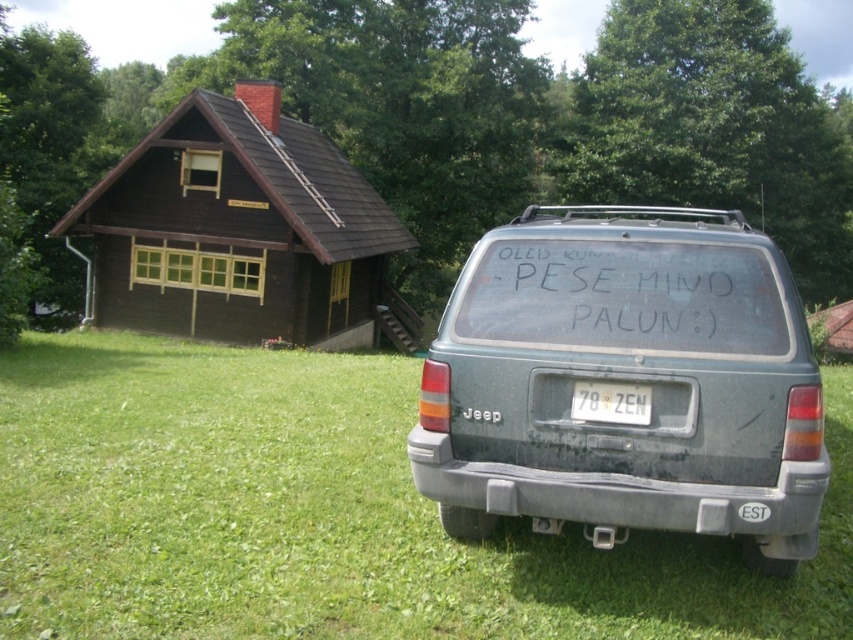
Question: Which object is closer to the camera taking this photo?

Choices:
 (A) white plastic license plate at center
 (B) matte gray suv at right

Answer: (B)

Question: Observing the image, what is the correct spatial positioning of green grass at center in reference to black matte text at rear?

Choices:
 (A) right
 (B) left

Answer: (B)

Question: Based on their relative distances, which object is nearer to the green grass at center?

Choices:
 (A) matte gray suv at right
 (B) white plastic license plate at center
 (C) black matte text at rear

Answer: (B)

Question: Which of these objects is positioned closest to the matte gray suv at right?

Choices:
 (A) white plastic license plate at center
 (B) black matte text at rear

Answer: (B)

Question: Is green grass at center below white plastic license plate at center?

Choices:
 (A) no
 (B) yes

Answer: (B)

Question: Does green grass at center come behind matte gray suv at right?

Choices:
 (A) yes
 (B) no

Answer: (B)